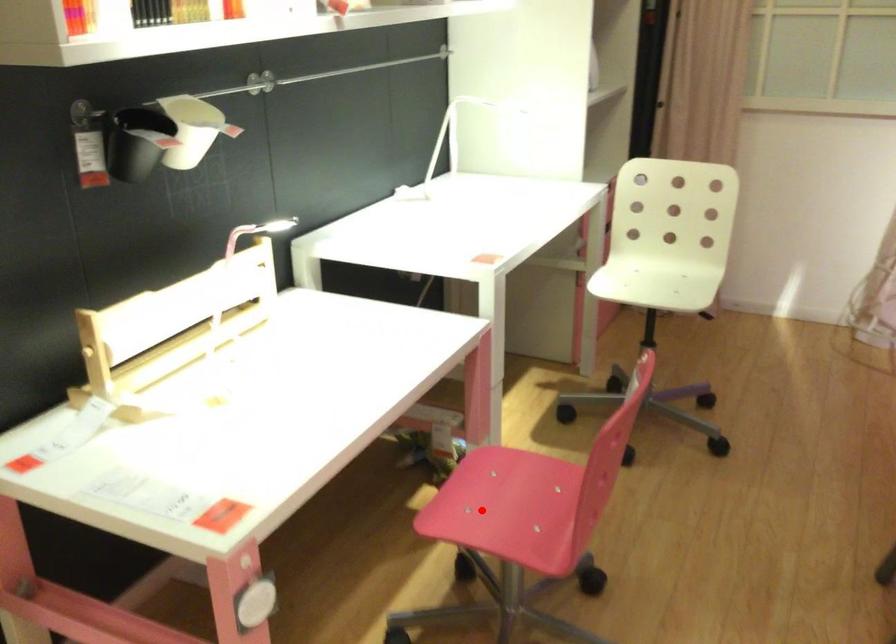
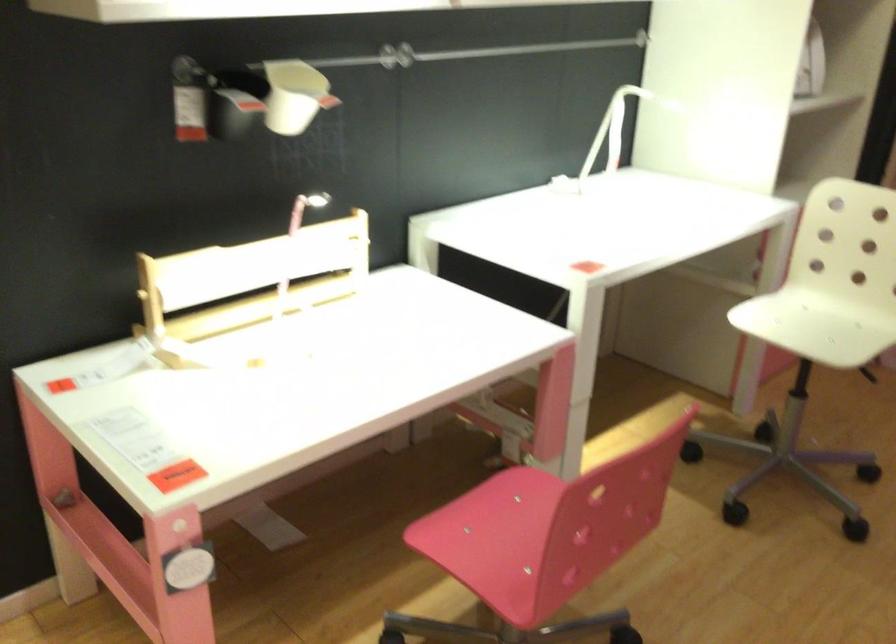
The point at the highlighted location is marked in the first image. Where is the corresponding point in the second image?

(479, 535)